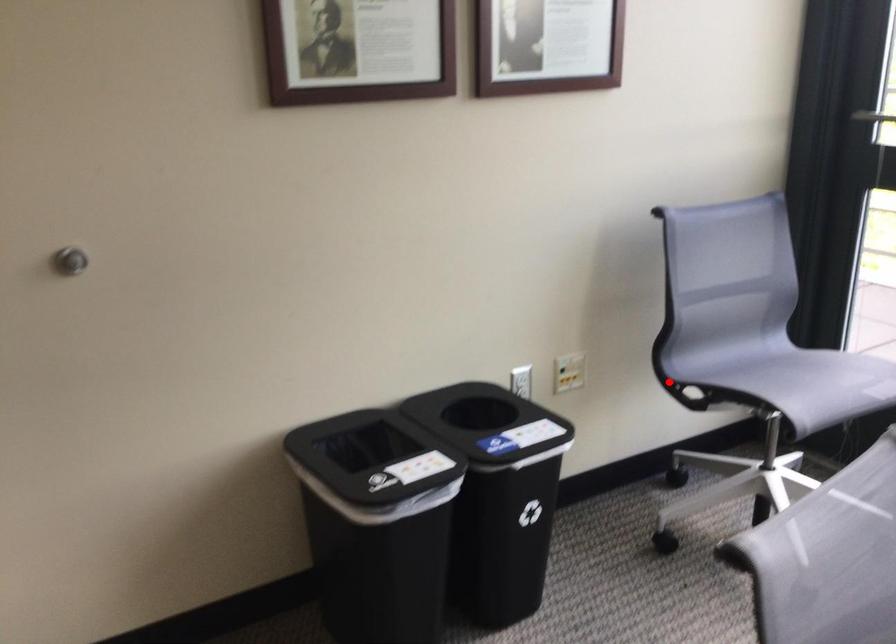
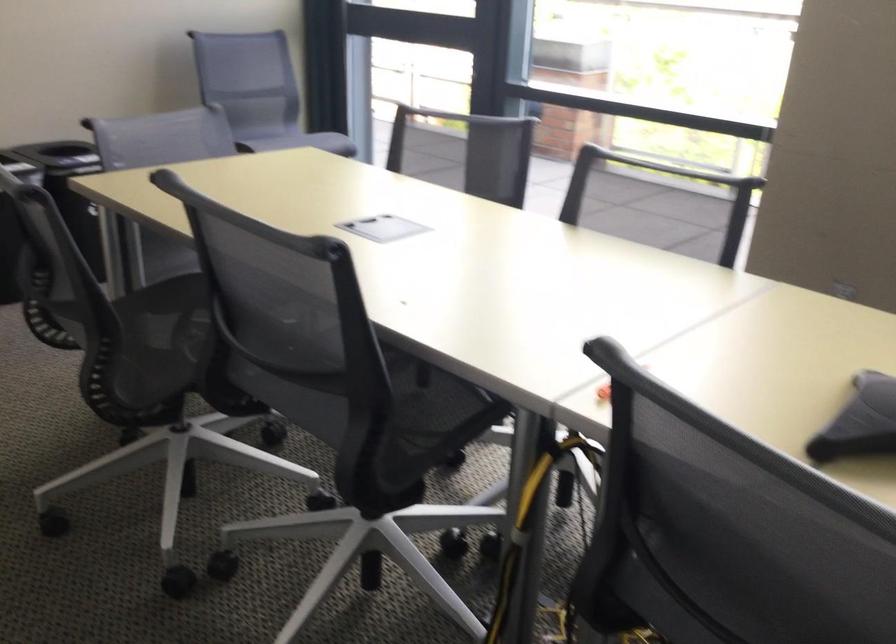
Question: I am providing you with two images of the same scene from different viewpoints. A red point is marked on the first image. Is the red point's position out of view in image 2?

Choices:
 (A) Yes
 (B) No

Answer: (A)